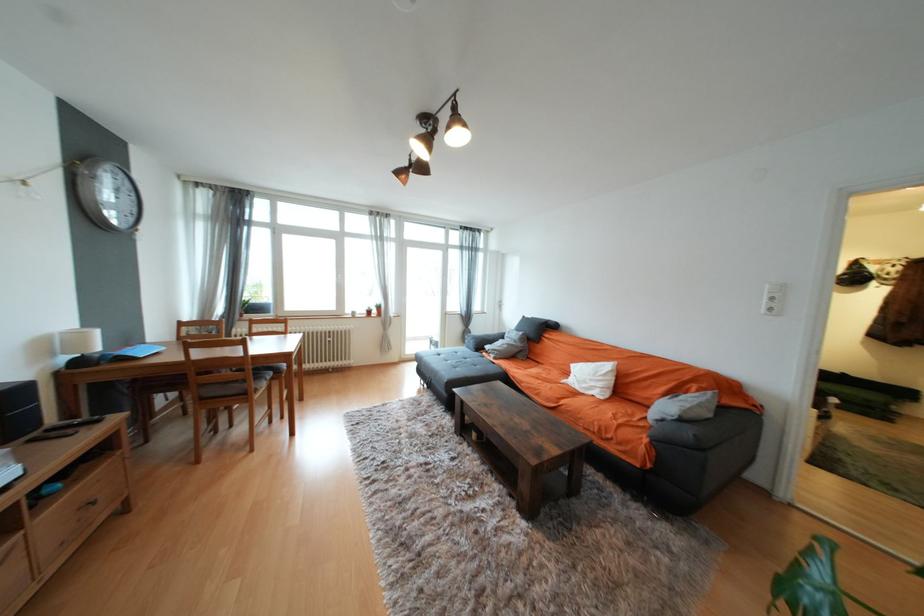
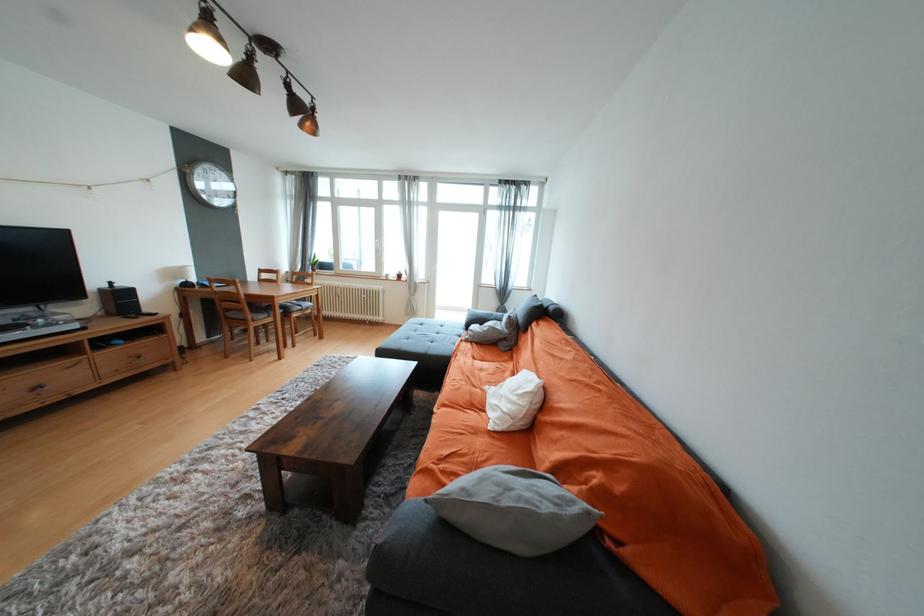
Locate, in the second image, the point that corresponds to pixel 512 347 in the first image.

(492, 330)